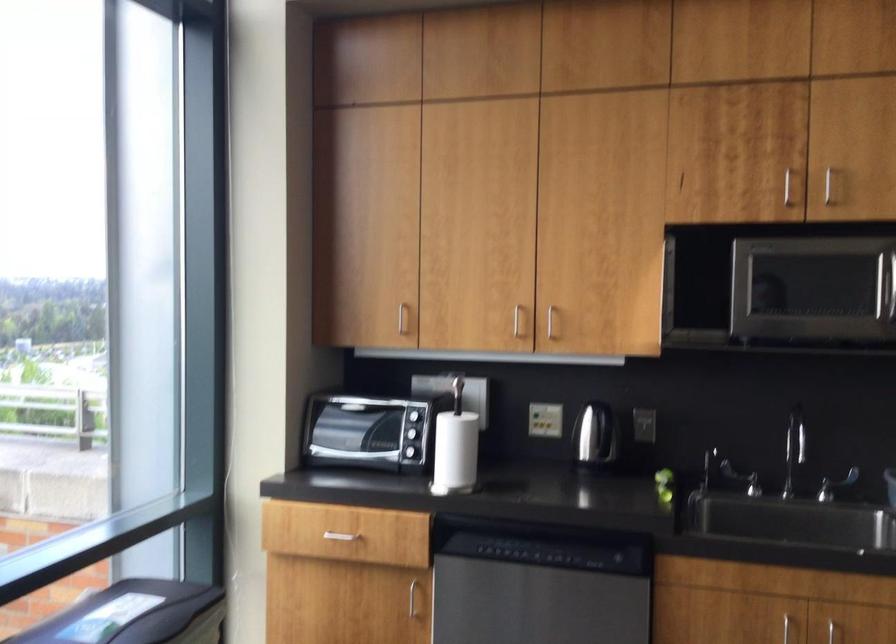
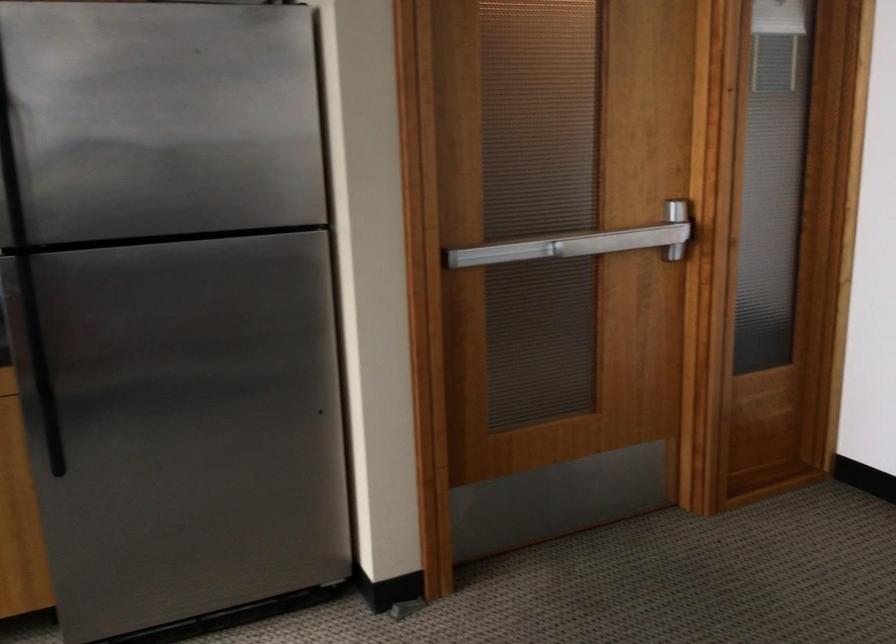
Question: The camera is either moving clockwise (left) or counter-clockwise (right) around the object. The first image is from the beginning of the video and the second image is from the end. Is the camera moving left or right when shooting the video?

Choices:
 (A) Left
 (B) Right

Answer: (A)